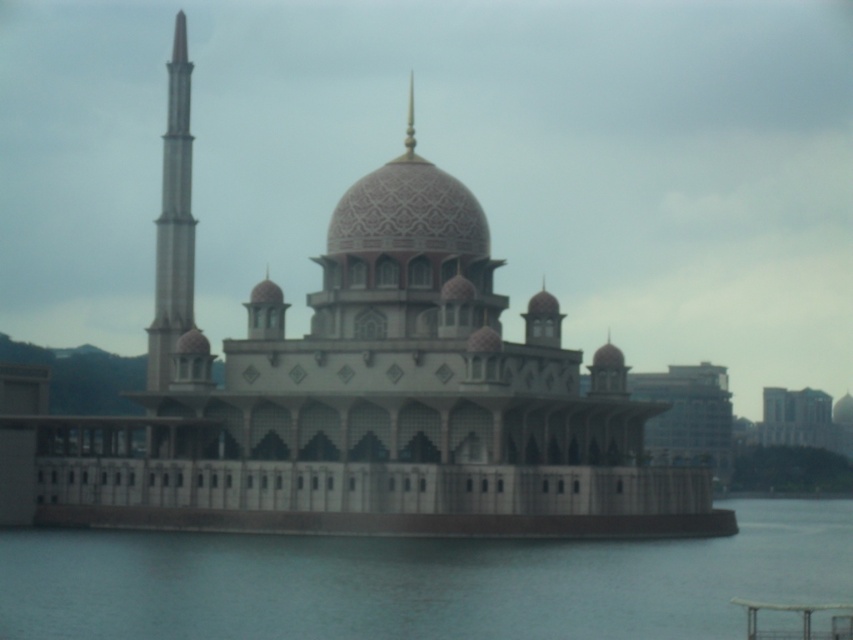
Question: Can you confirm if clear water at lower center is bigger than smooth concrete minaret at left?

Choices:
 (A) yes
 (B) no

Answer: (A)

Question: Is clear water at lower center below smooth concrete minaret at left?

Choices:
 (A) yes
 (B) no

Answer: (A)

Question: Which point is closer to the camera?

Choices:
 (A) (842, 534)
 (B) (184, 275)

Answer: (B)

Question: Does clear water at lower center appear on the left side of smooth concrete minaret at left?

Choices:
 (A) yes
 (B) no

Answer: (B)